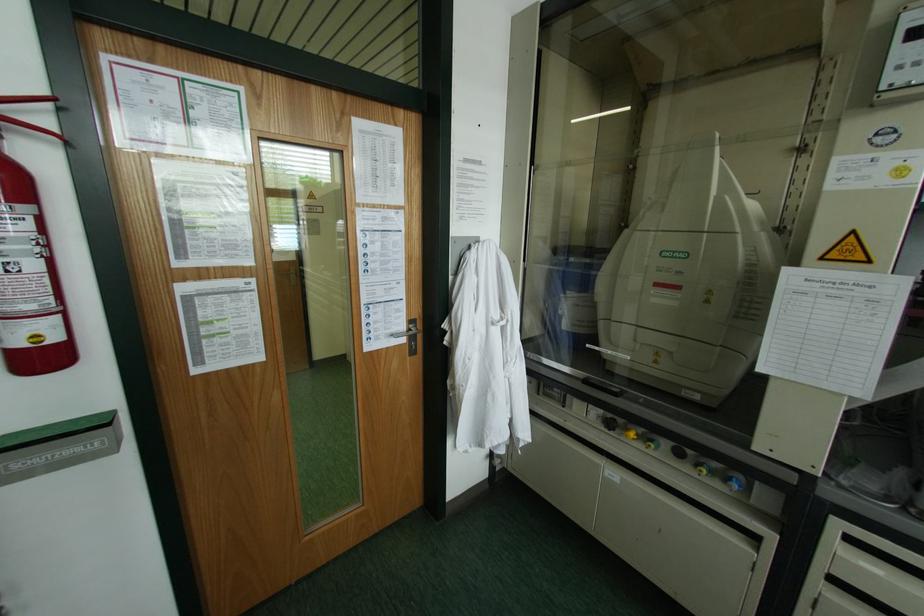
The image size is (924, 616). What do you see at coordinates (407, 331) in the screenshot? I see `the silver door handle` at bounding box center [407, 331].